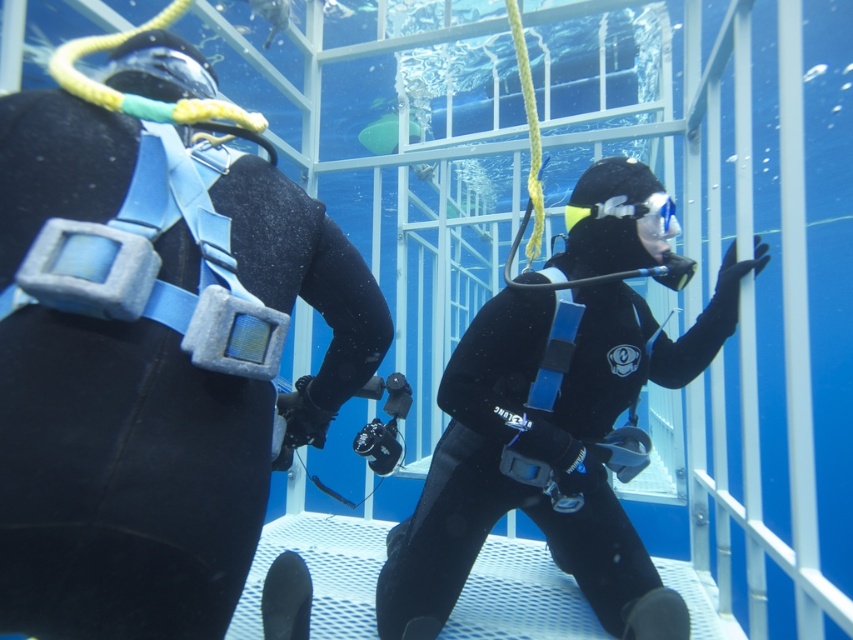
Question: Does black matte wetsuit at center have a smaller size compared to clear plastic goggles at center?

Choices:
 (A) no
 (B) yes

Answer: (A)

Question: Among these objects, which one is nearest to the camera?

Choices:
 (A) clear plastic goggles at center
 (B) black matte wetsuit at center
 (C) black matte wetsuit at left

Answer: (C)

Question: Which point is farther to the camera?

Choices:
 (A) black matte wetsuit at left
 (B) black matte wetsuit at center

Answer: (B)

Question: Where is black matte wetsuit at center located in relation to clear plastic goggles at center in the image?

Choices:
 (A) below
 (B) above

Answer: (A)

Question: Which object is the farthest from the black matte wetsuit at left?

Choices:
 (A) clear plastic goggles at center
 (B) black matte wetsuit at center

Answer: (A)

Question: Considering the relative positions of black matte wetsuit at left and black matte wetsuit at center in the image provided, where is black matte wetsuit at left located with respect to black matte wetsuit at center?

Choices:
 (A) right
 (B) left

Answer: (B)